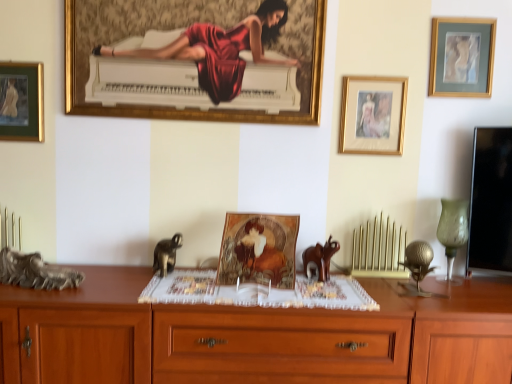
Find the location of a particular element. This screenshot has height=384, width=512. free spot above wooden drawer at center (from a real-world perspective) is located at coordinates (258, 287).